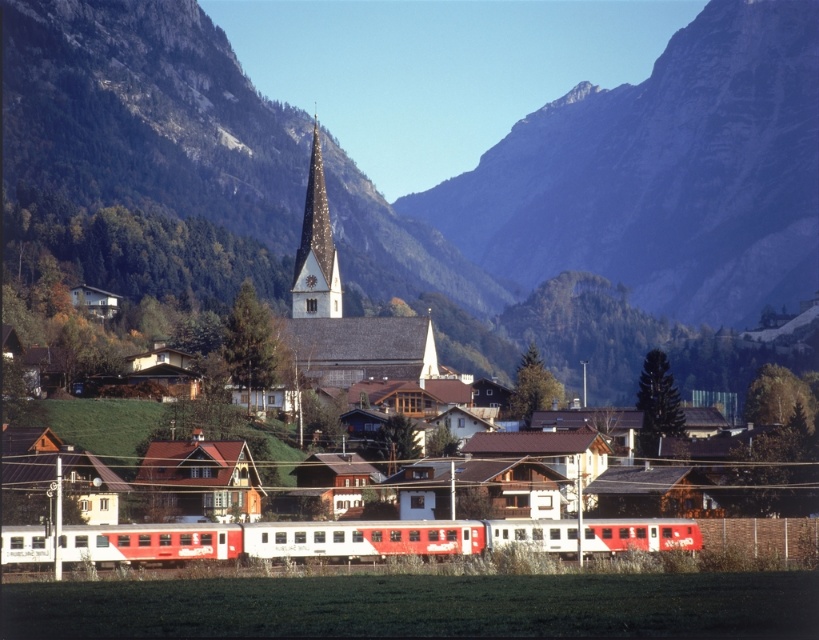
Question: Observing the image, what is the correct spatial positioning of white glossy passenger train at center in reference to gold textured spire at center?

Choices:
 (A) left
 (B) right

Answer: (B)

Question: Can you confirm if rugged stone mountain at center is positioned to the right of gold textured spire at center?

Choices:
 (A) yes
 (B) no

Answer: (A)

Question: Which is nearer to the matte gray steeple at center?

Choices:
 (A) rugged stone mountain at center
 (B) white glossy passenger train at center

Answer: (B)

Question: Which of the following is the farthest from the observer?

Choices:
 (A) matte gray steeple at center
 (B) gold textured spire at center
 (C) rugged stone mountain at center
 (D) white glossy passenger train at center

Answer: (C)

Question: Which of the following is the farthest from the observer?

Choices:
 (A) (320, 282)
 (B) (415, 321)
 (C) (620, 112)
 (D) (278, 554)

Answer: (C)

Question: Does rugged stone mountain at center appear under matte gray steeple at center?

Choices:
 (A) no
 (B) yes

Answer: (A)